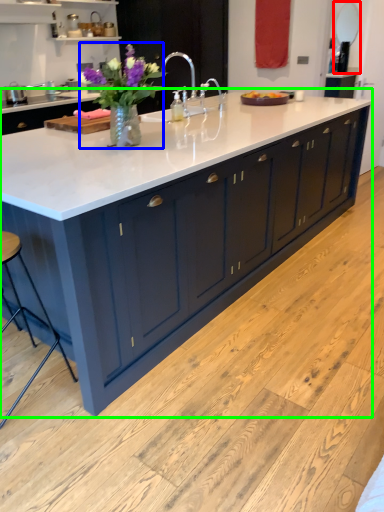
Question: Based on their relative distances, which object is farther from mirror (highlighted by a red box)? Choose from flower (highlighted by a blue box) and countertop (highlighted by a green box).

Choices:
 (A) flower
 (B) countertop

Answer: (A)